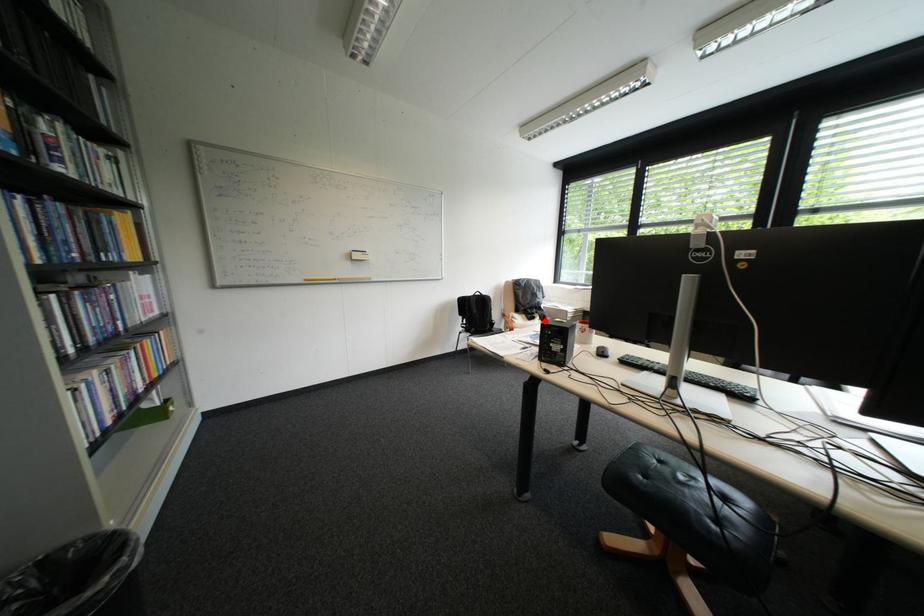
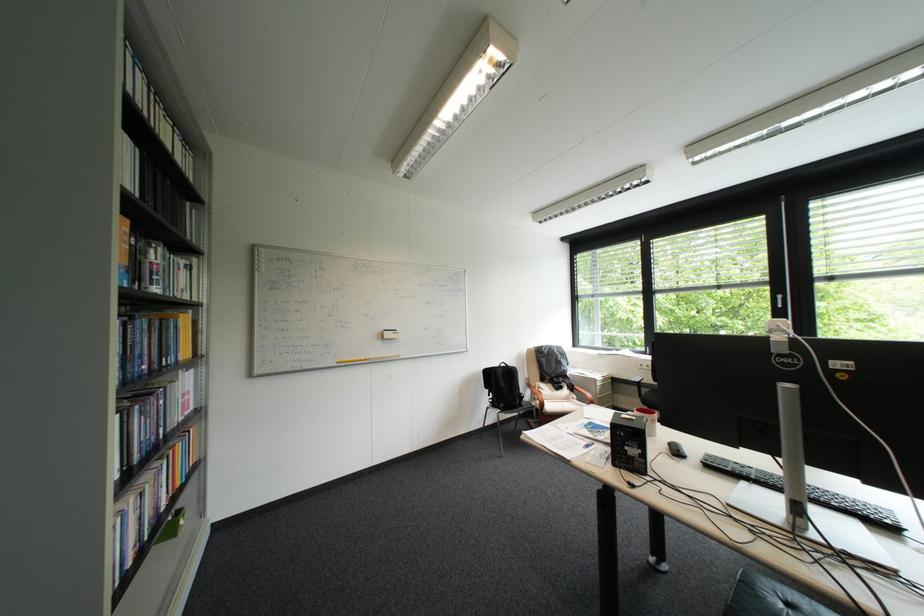
The point at the highlighted location is marked in the first image. Where is the corresponding point in the second image?

(573, 391)